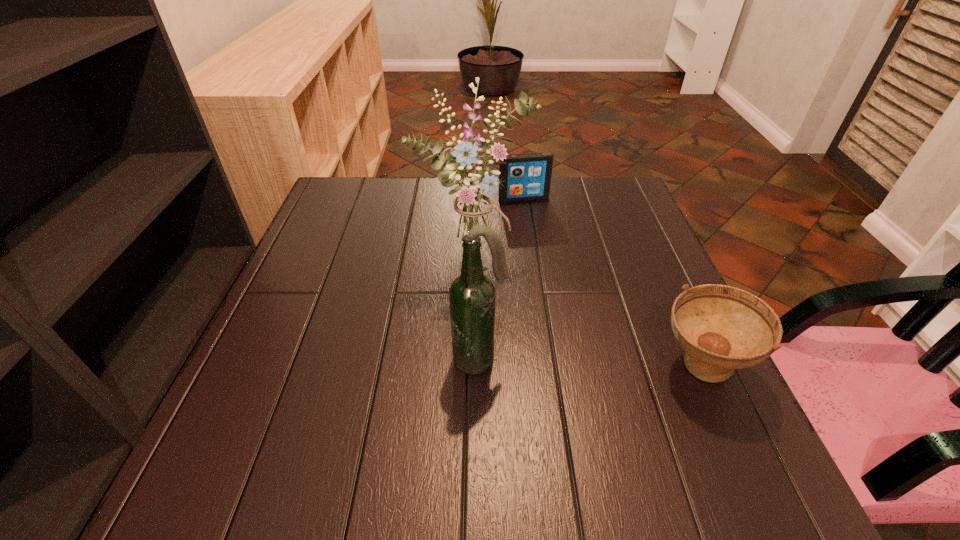
The image size is (960, 540). In order to click on free space on the desktop that is between the beer bottle and the rightmost object and is positioned on the front screen of the iPod in this screenshot , I will do `click(587, 363)`.

I want to click on vacant space on the desktop that is between the third shortest object and the rightmost object and is positioned on the front-facing side of the second farthest object, so click(x=587, y=363).